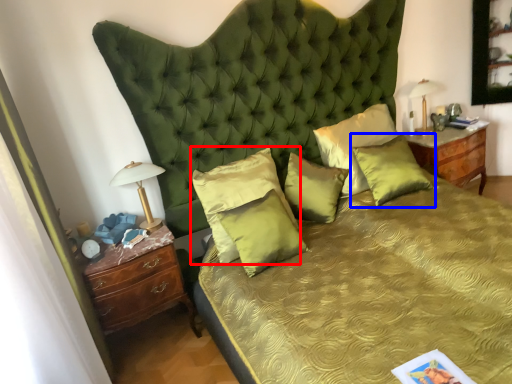
Question: Which object appears farthest to the camera in this image, pillow (highlighted by a red box) or pillow (highlighted by a blue box)?

Choices:
 (A) pillow
 (B) pillow

Answer: (B)